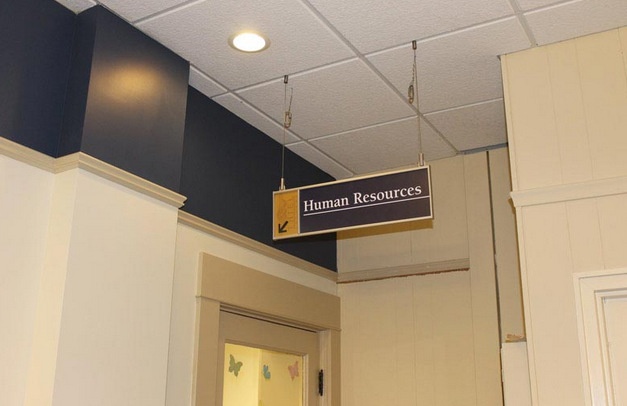
I want to click on door frame, so click(x=327, y=354), click(x=334, y=357), click(x=224, y=279), click(x=196, y=328).